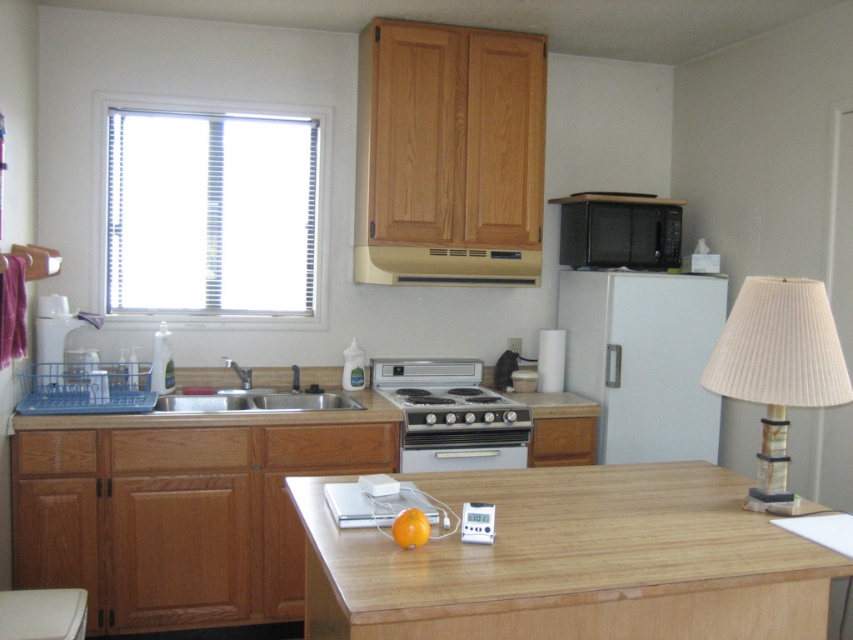
Which of these two, wooden at center or white matte refrigerator at center-right, stands shorter?

Standing shorter between the two is wooden at center.

Is wooden at center thinner than white matte refrigerator at center-right?

No, wooden at center is not thinner than white matte refrigerator at center-right.

Image resolution: width=853 pixels, height=640 pixels. Describe the element at coordinates (572, 561) in the screenshot. I see `wooden at center` at that location.

You are a GUI agent. You are given a task and a screenshot of the screen. Output one action in this format:
    pyautogui.click(x=<x>, y=<y>)
    Task: Click on the wooden at center
    Image resolution: width=853 pixels, height=640 pixels.
    Given the screenshot: What is the action you would take?
    pyautogui.click(x=572, y=561)

Can you confirm if wooden at center is positioned to the right of white plastic dishwasher at lower left?

Yes, wooden at center is to the right of white plastic dishwasher at lower left.

Can you confirm if wooden at center is thinner than white plastic dishwasher at lower left?

Incorrect, wooden at center's width is not less than white plastic dishwasher at lower left's.

Does point (659, 538) come behind point (76, 625)?

No, it is not.

At what (x,y) coordinates should I click in order to perform the action: click on wooden at center. Please return your answer as a coordinate pair (x, y). Looking at the image, I should click on (572, 561).

Is silver metallic sink at lower center to the left of satin silver oven at center from the viewer's perspective?

Correct, you'll find silver metallic sink at lower center to the left of satin silver oven at center.

This screenshot has width=853, height=640. I want to click on silver metallic sink at lower center, so pos(253,392).